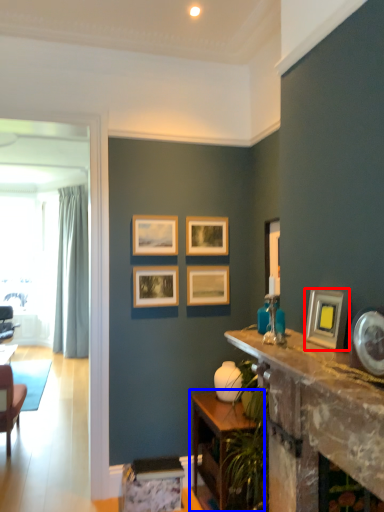
Question: Which object appears closest to the camera in this image, picture frame (highlighted by a red box) or table (highlighted by a blue box)?

Choices:
 (A) picture frame
 (B) table

Answer: (A)